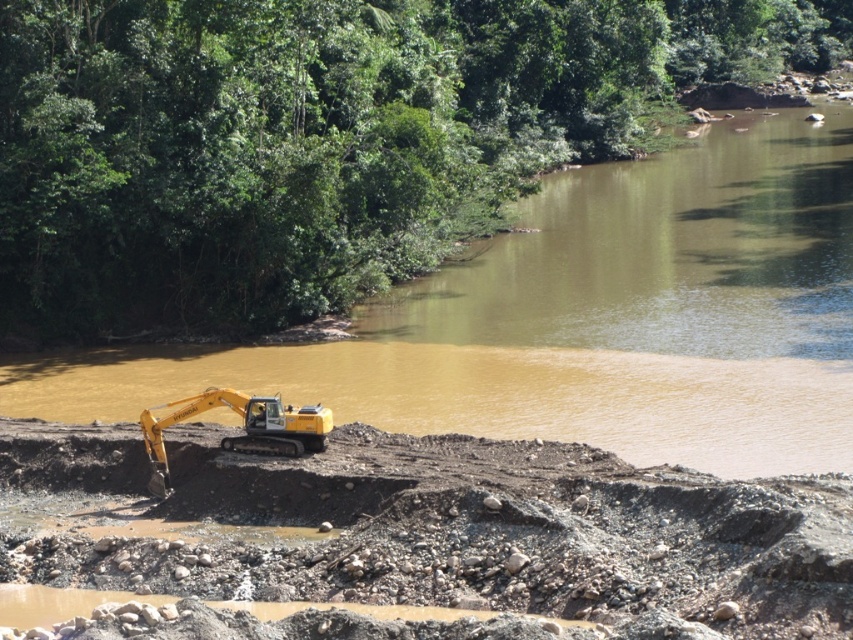
You are a construction worker planning to move the yellow tracked excavator at lower left to a safer location away from the river. Based on its current coordinates, which direction should you move it to ensure it stays on stable ground?

The yellow tracked excavator at lower left is located at coordinates point (x=495, y=532). To move it to stable ground away from the river, you should move it in the direction opposite to the riverbank, which is towards the higher elevation or inland area, ensuring it stays on firmer terrain.